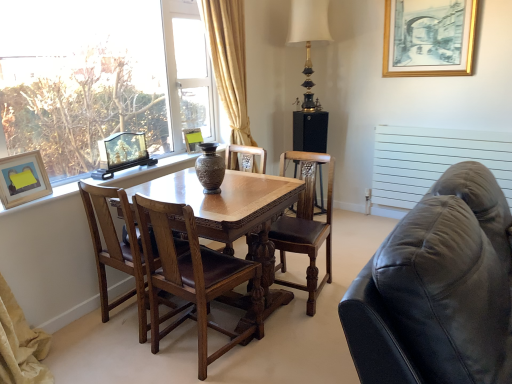
Image resolution: width=512 pixels, height=384 pixels. What are the coordinates of `vacant area situated to the left side of brown leather chair at center, marked as the 2th chair in a right-to-left arrangement` in the screenshot? It's located at click(118, 356).